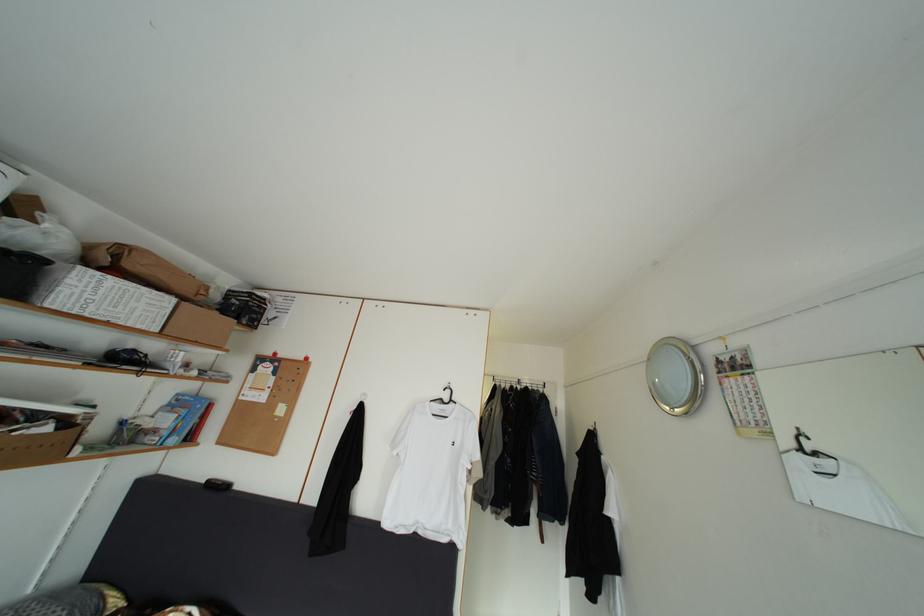
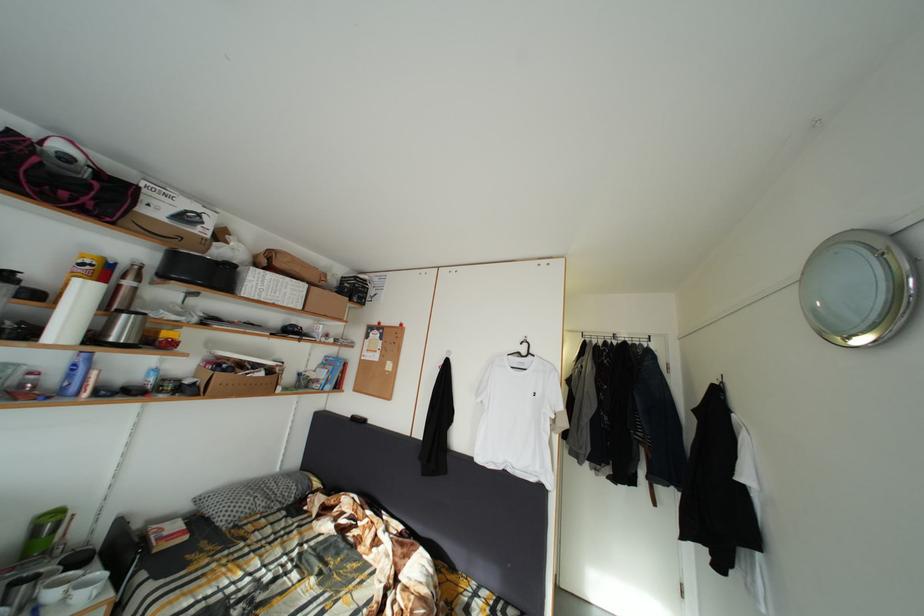
Question: How did the camera likely rotate?

Choices:
 (A) Left
 (B) Right
 (C) Up
 (D) Down

Answer: (A)